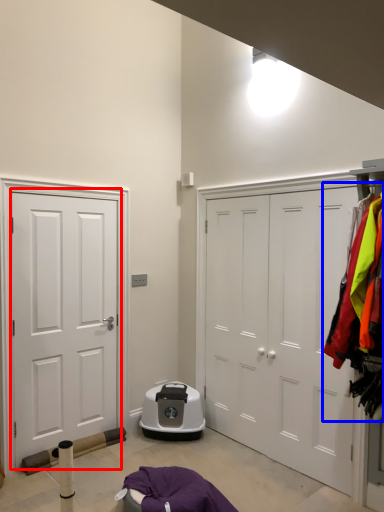
Question: Which point is closer to the camera, door (highlighted by a red box) or laundry (highlighted by a blue box)?

Choices:
 (A) door
 (B) laundry

Answer: (B)